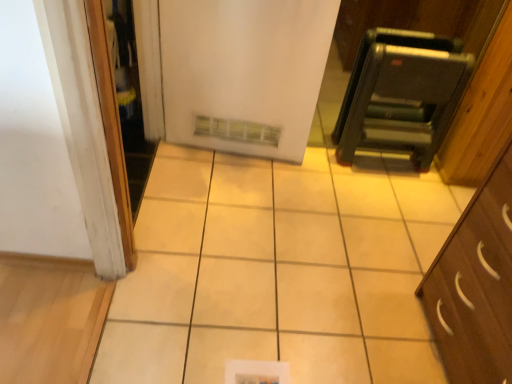
You are a GUI agent. You are given a task and a screenshot of the screen. Output one action in this format:
    pyautogui.click(x=<x>, y=<y>)
    Task: Click on the vacant area situated below white matte refrigerator at center (from a real-world perspective)
    Image resolution: width=512 pixels, height=384 pixels.
    Given the screenshot: What is the action you would take?
    pyautogui.click(x=232, y=151)